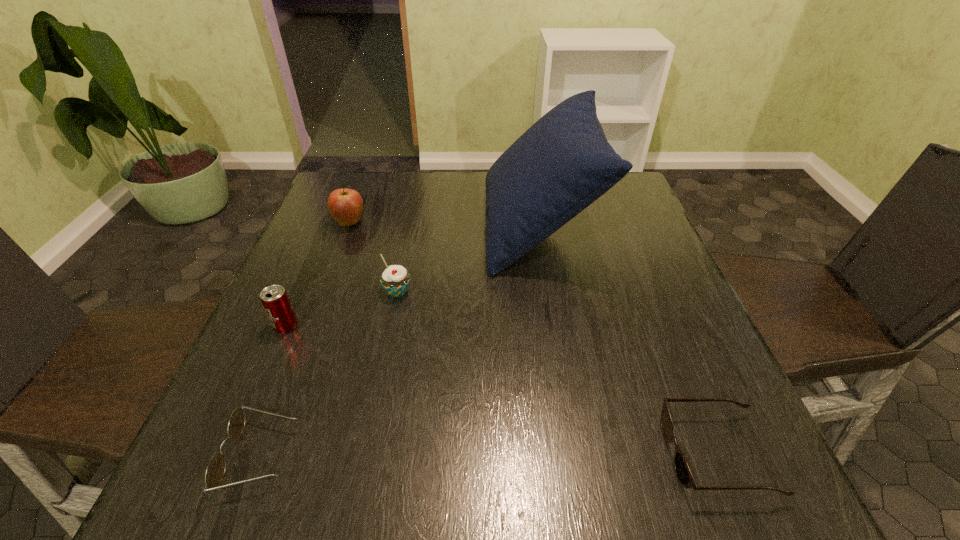
Locate an element on the screen. the fifth object from left to right is located at coordinates (563, 163).

Image resolution: width=960 pixels, height=540 pixels. I want to click on cushion, so click(x=563, y=163).

Find the location of a particular element. This screenshot has height=540, width=960. apple is located at coordinates (345, 205).

The width and height of the screenshot is (960, 540). I want to click on beer can, so click(x=274, y=299).

Locate an element on the screen. The height and width of the screenshot is (540, 960). the third object from right to left is located at coordinates (395, 279).

The image size is (960, 540). Find the location of `the fourth nearest object`. the fourth nearest object is located at coordinates (395, 279).

Locate an element on the screen. Image resolution: width=960 pixels, height=540 pixels. spectacles is located at coordinates (215, 471).

At what (x,y) coordinates should I click in order to perform the action: click on sunglasses. Please return your answer as a coordinate pair (x, y). This screenshot has width=960, height=540. Looking at the image, I should click on (683, 472).

This screenshot has height=540, width=960. What are the coordinates of `vacant space located on the facing side of the second object from right to left` in the screenshot? It's located at (446, 227).

Locate an element on the screen. vacant space located 0.140m on the facing side of the second object from right to left is located at coordinates (431, 227).